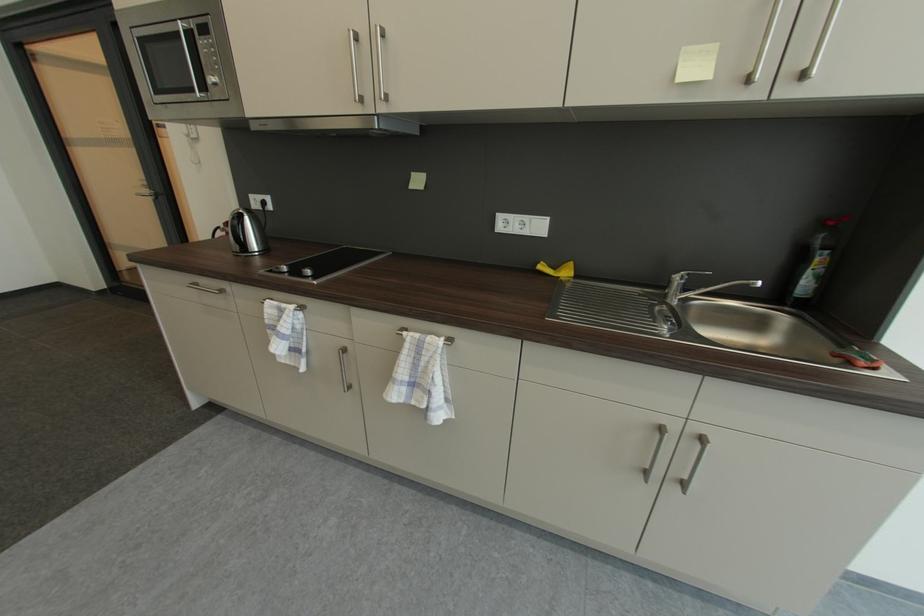
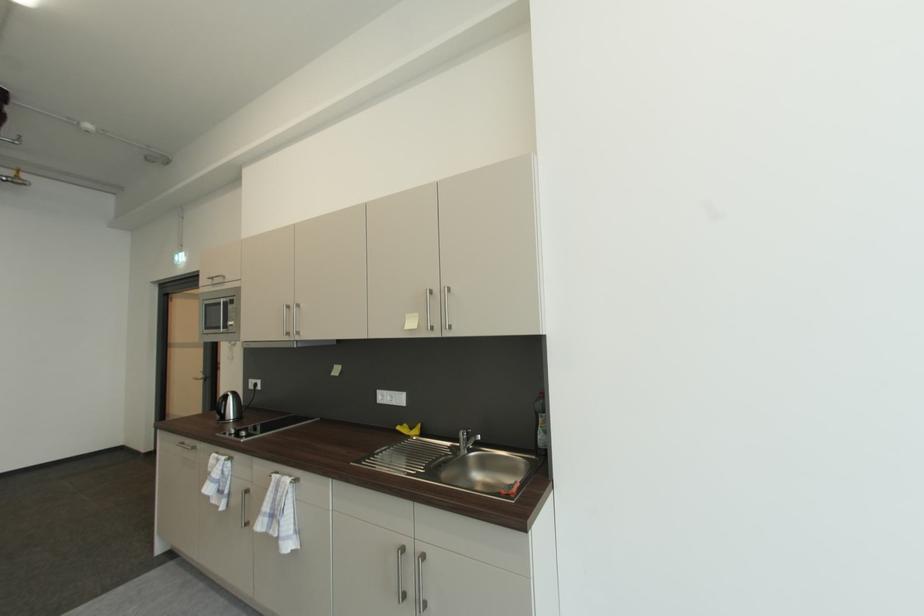
In the second image, find the point that corresponds to point (242, 224) in the first image.

(227, 402)